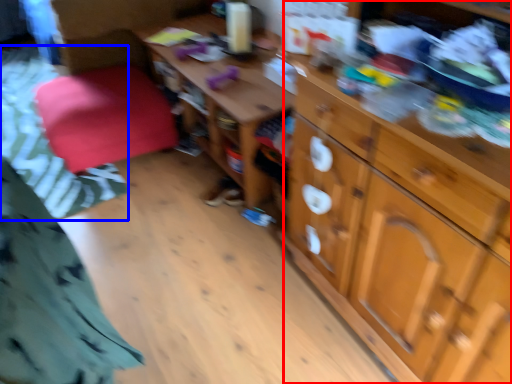
Question: Which object is further to the camera taking this photo, cabinetry (highlighted by a red box) or bedding (highlighted by a blue box)?

Choices:
 (A) cabinetry
 (B) bedding

Answer: (B)